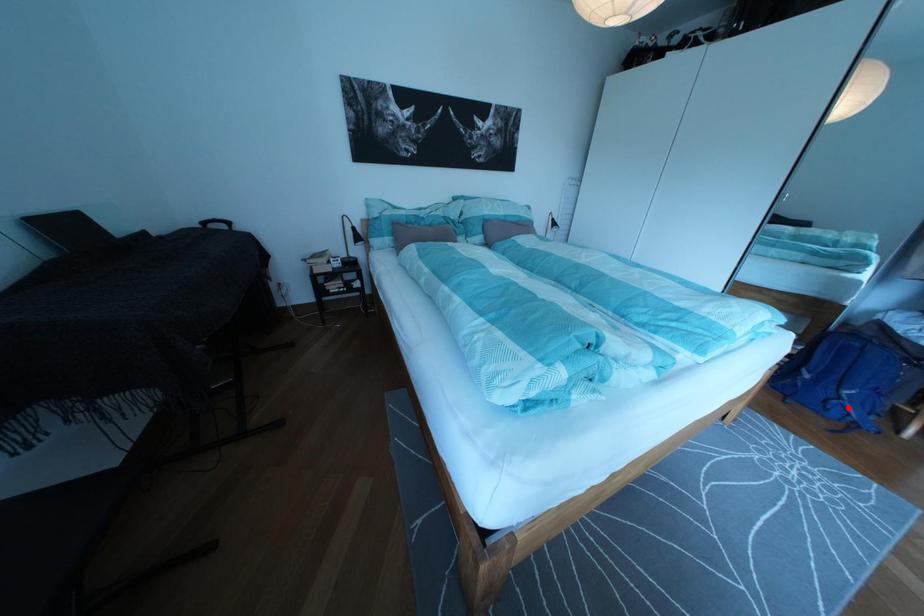
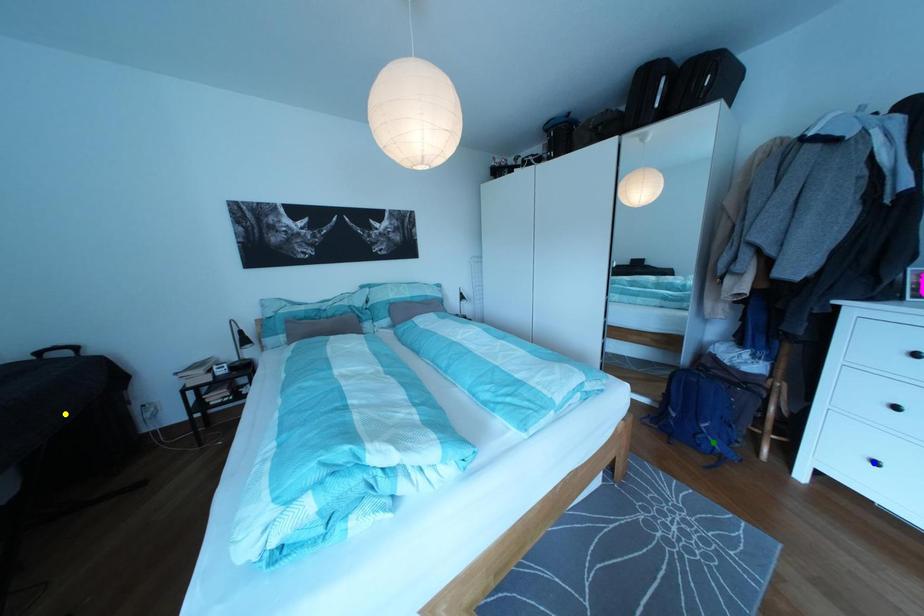
Question: I am providing you with two images of the same scene from different viewpoints. A red point is marked on the first image. You are given multiple points on the second image. In image 2, which mark is for the same physical point as the one in image 1?

Choices:
 (A) green point
 (B) blue point
 (C) yellow point

Answer: (A)